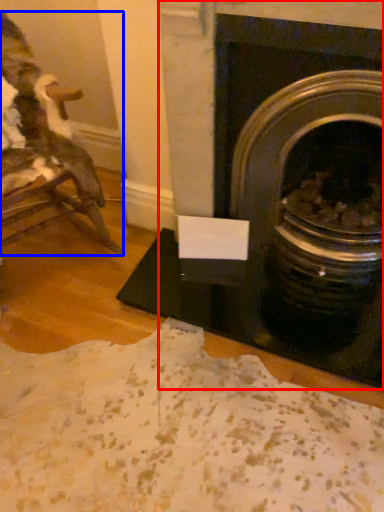
Question: Which of the following is the farthest to the observer, fireplace (highlighted by a red box) or chair (highlighted by a blue box)?

Choices:
 (A) fireplace
 (B) chair

Answer: (A)